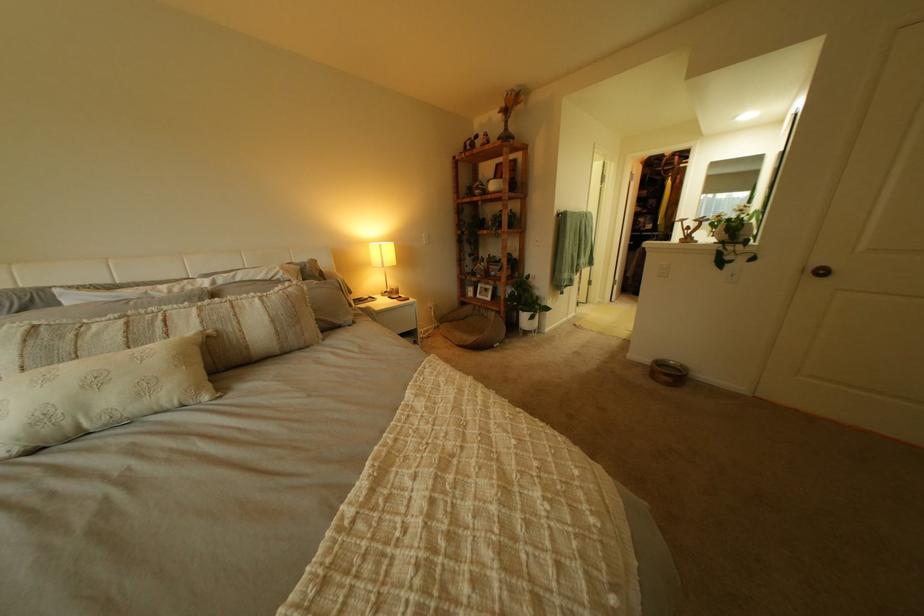
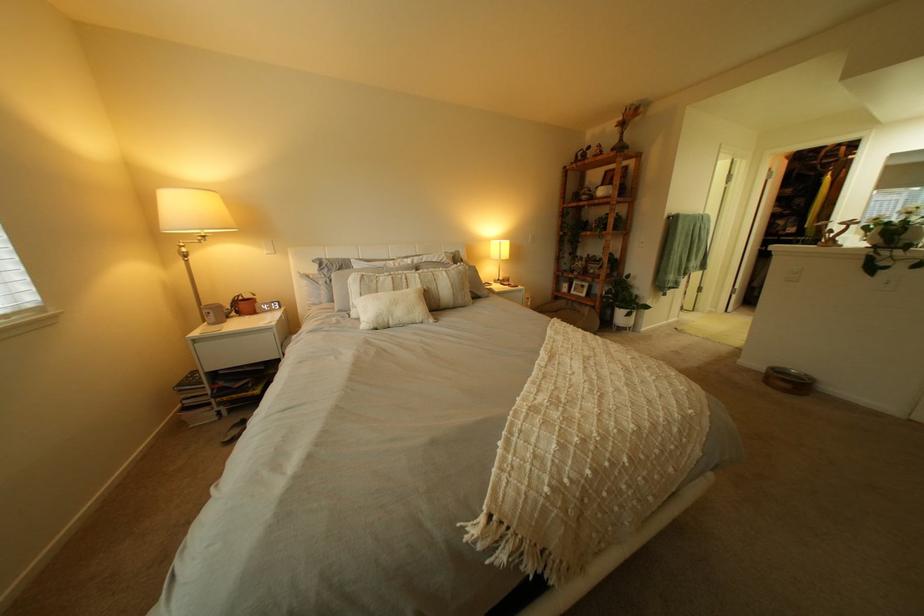
Where in the second image is the point corresponding to point (663, 362) from the first image?

(779, 369)